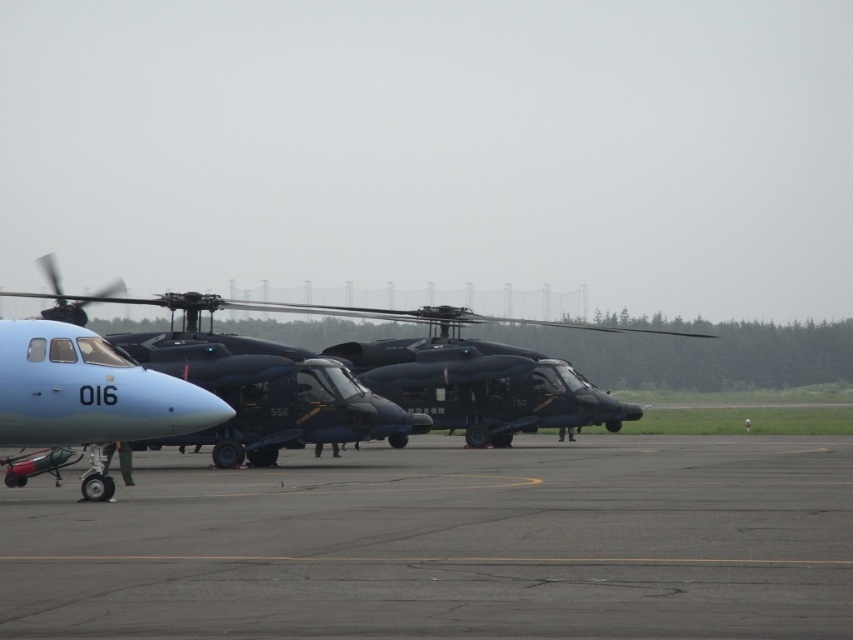
Question: Is matte blue airplane at lower left further to the viewer compared to matte black helicopter at center?

Choices:
 (A) no
 (B) yes

Answer: (A)

Question: Estimate the real-world distances between objects in this image. Which object is closer to the matte blue airplane at lower left?

Choices:
 (A) gray asphalt tarmac at lower center
 (B) matte black helicopter at center

Answer: (A)

Question: Does matte blue airplane at lower left have a larger size compared to matte black helicopter at center?

Choices:
 (A) yes
 (B) no

Answer: (B)

Question: Which object is the farthest from the matte black helicopter at center?

Choices:
 (A) matte blue airplane at lower left
 (B) gray asphalt tarmac at lower center

Answer: (B)

Question: Which point appears closest to the camera in this image?

Choices:
 (A) (248, 472)
 (B) (165, 392)

Answer: (B)

Question: Is gray asphalt tarmac at lower center smaller than matte black helicopter at center?

Choices:
 (A) yes
 (B) no

Answer: (A)